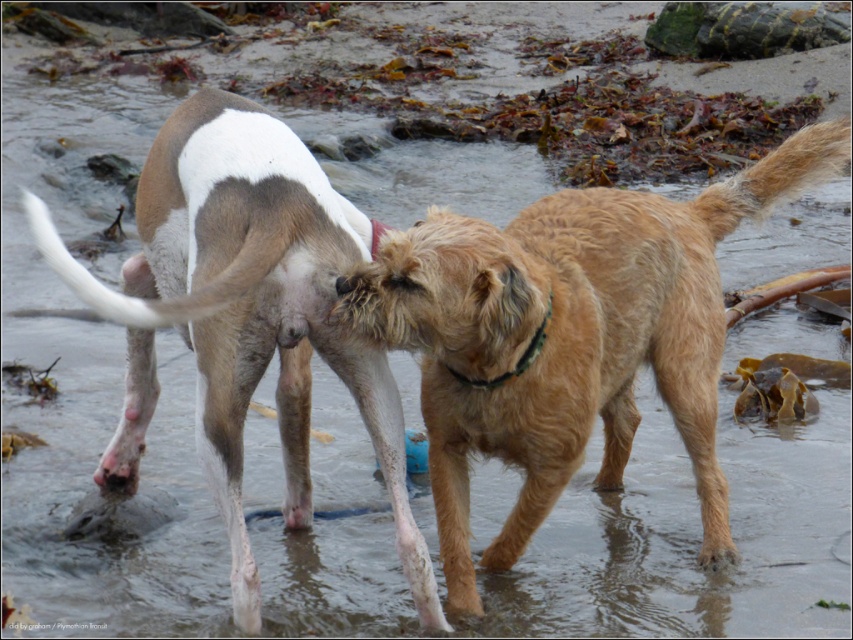
In the scene shown: Measure the distance from golden fur dog at center to brown fur dog at center.

golden fur dog at center is 18.57 inches from brown fur dog at center.

Who is higher up, golden fur dog at center or brown fur dog at center?

golden fur dog at center

Is point (688, 342) positioned in front of point (387, 403)?

No, (688, 342) is further to viewer.

Where is `golden fur dog at center`? The width and height of the screenshot is (853, 640). golden fur dog at center is located at coordinates (567, 337).